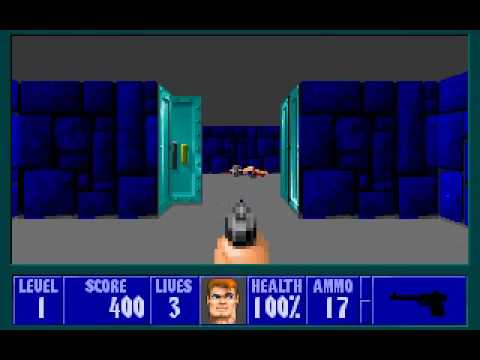
Where is `blue wall`? The image size is (480, 360). blue wall is located at coordinates (61, 185).